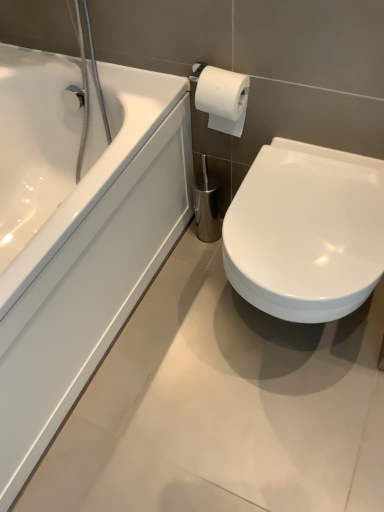
The image size is (384, 512). What are the coordinates of `free spot above white glossy toilet at lower right (from a real-world perspective)` in the screenshot? It's located at (310, 209).